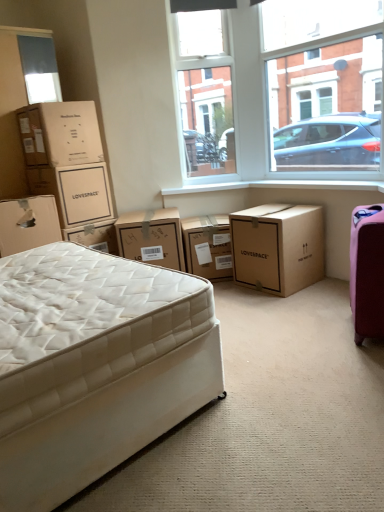
The image size is (384, 512). In order to click on vacant space behind pink fabric suitcase at right in this screenshot , I will do `click(327, 310)`.